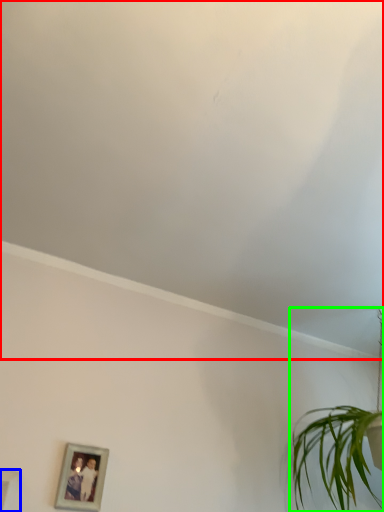
Question: Which is nearer to the cloud (highlighted by a red box)? picture frame (highlighted by a blue box) or houseplant (highlighted by a green box).

Choices:
 (A) picture frame
 (B) houseplant

Answer: (B)